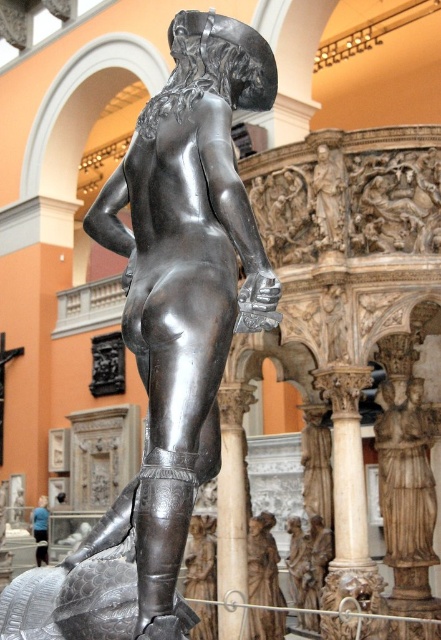
Question: Considering the relative positions of polished marble statue at center and smooth marble pillar at center in the image provided, where is polished marble statue at center located with respect to smooth marble pillar at center?

Choices:
 (A) below
 (B) above

Answer: (A)

Question: From the image, what is the correct spatial relationship of white marble column at center in relation to blue fabric pants at lower left?

Choices:
 (A) left
 (B) right

Answer: (B)

Question: Estimate the real-world distances between objects in this image. Which object is closer to the smooth marble pillar at center?

Choices:
 (A) blue fabric pants at lower left
 (B) polished bronze statue at center
 (C) polished marble statue at center

Answer: (C)

Question: Which of these objects is positioned farthest from the white marble column at center?

Choices:
 (A) polished bronze statue at center
 (B) blue fabric pants at lower left
 (C) smooth marble pillar at center

Answer: (B)

Question: Is polished marble statue at center wider than smooth marble pillar at center?

Choices:
 (A) yes
 (B) no

Answer: (A)

Question: Among these points, which one is nearest to the camera?

Choices:
 (A) (347, 493)
 (B) (238, 456)

Answer: (A)